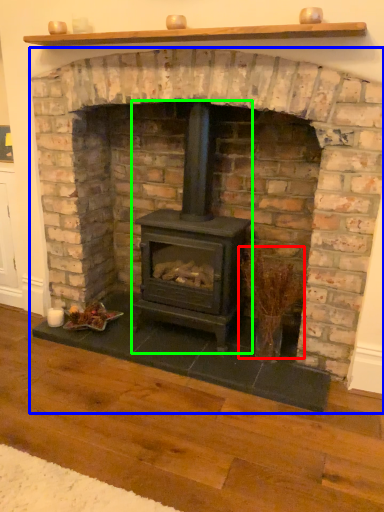
Question: Which object is positioned closest to twig (highlighted by a red box)? Select from fireplace (highlighted by a blue box) and wood burning stove (highlighted by a green box).

Choices:
 (A) fireplace
 (B) wood burning stove

Answer: (B)